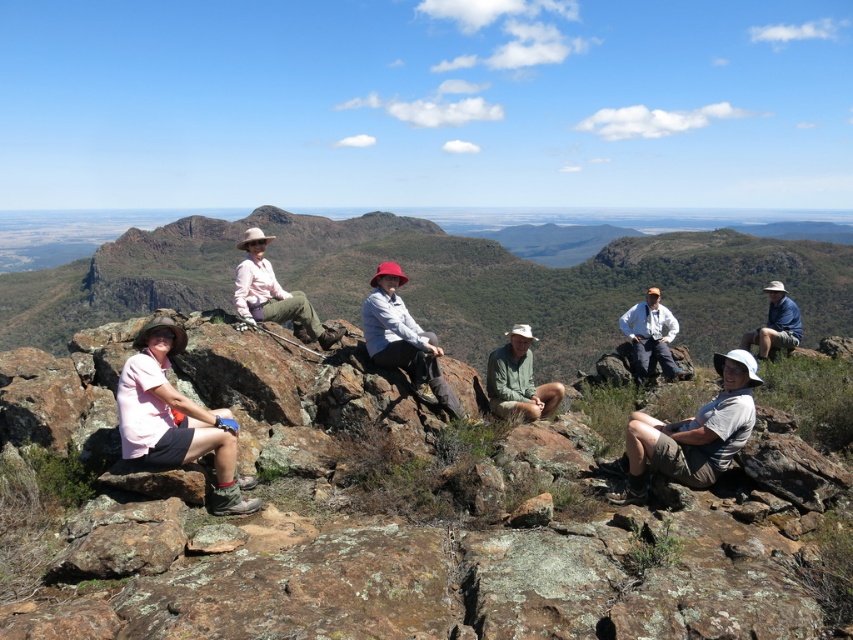
Question: Is rugged rock formation at center thinner than white cotton shirt at center?

Choices:
 (A) no
 (B) yes

Answer: (A)

Question: Among these objects, which one is farthest from the camera?

Choices:
 (A) brown rough rock at center
 (B) white cotton shirt at center
 (C) pink fabric shirt at left

Answer: (B)

Question: Considering the real-world distances, which object is closest to the blue fabric shirt at center-right?

Choices:
 (A) gray fabric hat at lower right
 (B) matte pink shirt at center
 (C) brown rough rock at center
 (D) green matte shirt at center

Answer: (A)

Question: Is brown rough rock at center to the right of matte pink shirt at center from the viewer's perspective?

Choices:
 (A) yes
 (B) no

Answer: (A)

Question: Which point appears farthest from the camera in this image?

Choices:
 (A) (683, 378)
 (B) (625, 426)
 (C) (525, 612)
 (D) (750, 332)

Answer: (D)

Question: Can you confirm if matte pink shirt at center is wider than blue fabric shirt at center-right?

Choices:
 (A) yes
 (B) no

Answer: (B)